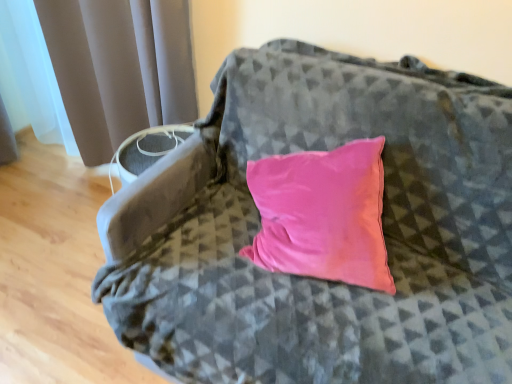
What is the approximate height of velvet pink pillow at center?

velvet pink pillow at center is 27.79 inches tall.

Describe the element at coordinates (317, 279) in the screenshot. This screenshot has height=384, width=512. I see `velvet pink pillow at center` at that location.

Where is `velvet pink pillow at center`? The width and height of the screenshot is (512, 384). velvet pink pillow at center is located at coordinates (317, 279).

Identify the location of satin gray curtain at left. The height and width of the screenshot is (384, 512). (119, 67).

Describe the element at coordinates (119, 67) in the screenshot. I see `satin gray curtain at left` at that location.

The height and width of the screenshot is (384, 512). I want to click on velvet pink pillow at center, so [317, 279].

Considering the relative positions of velvet pink pillow at center and satin gray curtain at left in the image provided, is velvet pink pillow at center to the left of satin gray curtain at left from the viewer's perspective?

Incorrect, velvet pink pillow at center is not on the left side of satin gray curtain at left.

Does velvet pink pillow at center come in front of satin gray curtain at left?

Yes, the depth of velvet pink pillow at center is less than that of satin gray curtain at left.

Between point (490, 140) and point (164, 74), which one is positioned in front?

The point (490, 140) is closer.

From the image's perspective, which one is positioned lower, velvet pink pillow at center or satin gray curtain at left?

velvet pink pillow at center, from the image's perspective.

From a real-world perspective, is velvet pink pillow at center above or below satin gray curtain at left?

Clearly, from a real-world perspective, velvet pink pillow at center is above satin gray curtain at left.

Considering the sizes of velvet pink pillow at center and satin gray curtain at left in the image, is velvet pink pillow at center wider or thinner than satin gray curtain at left?

In the image, velvet pink pillow at center appears to be wider than satin gray curtain at left.

Considering the sizes of objects velvet pink pillow at center and satin gray curtain at left in the image provided, who is taller, velvet pink pillow at center or satin gray curtain at left?

With more height is satin gray curtain at left.

Between velvet pink pillow at center and satin gray curtain at left, which one has smaller size?

velvet pink pillow at center is smaller.

Do you think velvet pink pillow at center is within satin gray curtain at left, or outside of it?

velvet pink pillow at center is located beyond the bounds of satin gray curtain at left.

Is velvet pink pillow at center with satin gray curtain at left?

No, velvet pink pillow at center is not in contact with satin gray curtain at left.

Is satin gray curtain at left at the back of velvet pink pillow at center?

No, velvet pink pillow at center's orientation is not away from satin gray curtain at left.

Locate an element on the screen. curtain below the velvet pink pillow at center (from a real-world perspective) is located at coordinates (119, 67).

Which is more to the right, satin gray curtain at left or velvet pink pillow at center?

Positioned to the right is velvet pink pillow at center.

Is satin gray curtain at left behind velvet pink pillow at center?

Yes, it is behind velvet pink pillow at center.

Considering the points (71, 41) and (359, 99), which point is in front, point (71, 41) or point (359, 99)?

Positioned in front is point (359, 99).

From the image's perspective, relative to velvet pink pillow at center, is satin gray curtain at left above or below?

satin gray curtain at left is above velvet pink pillow at center.

From a real-world perspective, which object stands above the other?

velvet pink pillow at center.

Considering the relative sizes of satin gray curtain at left and velvet pink pillow at center in the image provided, is satin gray curtain at left thinner than velvet pink pillow at center?

Yes.

From the picture: Can you confirm if satin gray curtain at left is taller than velvet pink pillow at center?

Yes.

Does satin gray curtain at left have a larger size compared to velvet pink pillow at center?

Indeed, satin gray curtain at left has a larger size compared to velvet pink pillow at center.

Is satin gray curtain at left inside or outside of velvet pink pillow at center?

The correct answer is: outside.

Does satin gray curtain at left touch velvet pink pillow at center?

No, satin gray curtain at left is not in contact with velvet pink pillow at center.

Is satin gray curtain at left looking in the opposite direction of velvet pink pillow at center?

No, satin gray curtain at left is not facing the opposite direction of velvet pink pillow at center.

In order to click on furniture to the right of satin gray curtain at left in this screenshot , I will do `click(317, 279)`.

Find the location of `curtain above the velvet pink pillow at center (from the image's perspective)`. curtain above the velvet pink pillow at center (from the image's perspective) is located at coordinates (119, 67).

Where is `curtain that is under the velvet pink pillow at center (from a real-world perspective)`? curtain that is under the velvet pink pillow at center (from a real-world perspective) is located at coordinates (119, 67).